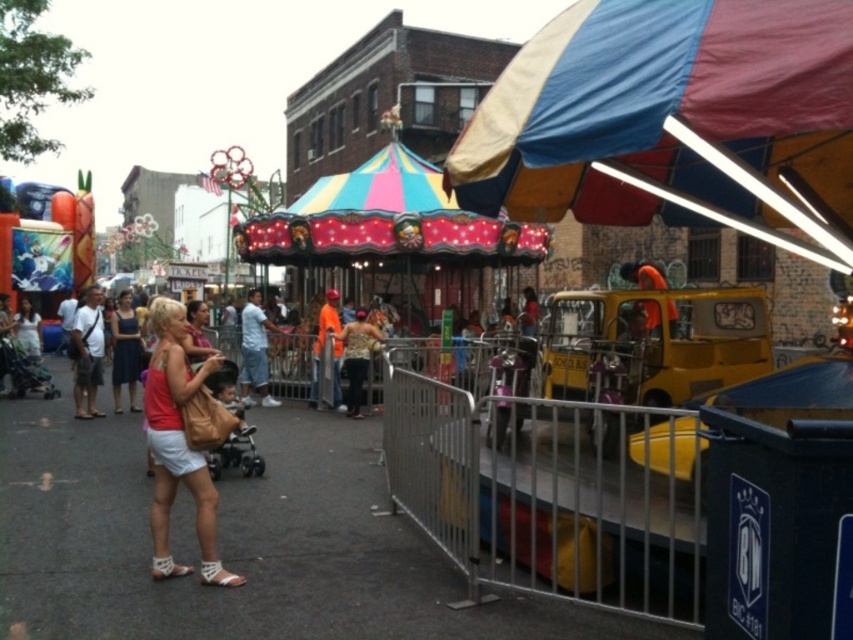
Question: Is matte blue dress at center to the right of orange fabric truck at center from the viewer's perspective?

Choices:
 (A) no
 (B) yes

Answer: (A)

Question: Which object is the farthest from the printed fabric shirt at center?

Choices:
 (A) light blue denim shorts at center
 (B) orange fabric truck at center
 (C) orange fabric at center
 (D) matte pink blouse at center

Answer: (D)

Question: Which is nearer to the orange fabric at center?

Choices:
 (A) light blue denim shorts at center
 (B) white cotton shorts at center

Answer: (A)

Question: Does matte blue dress at center have a larger size compared to orange fabric truck at center?

Choices:
 (A) yes
 (B) no

Answer: (A)

Question: Does multicolored fabric canopy at upper right have a larger size compared to orange fabric truck at center?

Choices:
 (A) yes
 (B) no

Answer: (B)

Question: Among these points, which one is farthest from the camera?

Choices:
 (A) (842, 4)
 (B) (170, 433)
 (C) (350, 349)

Answer: (C)